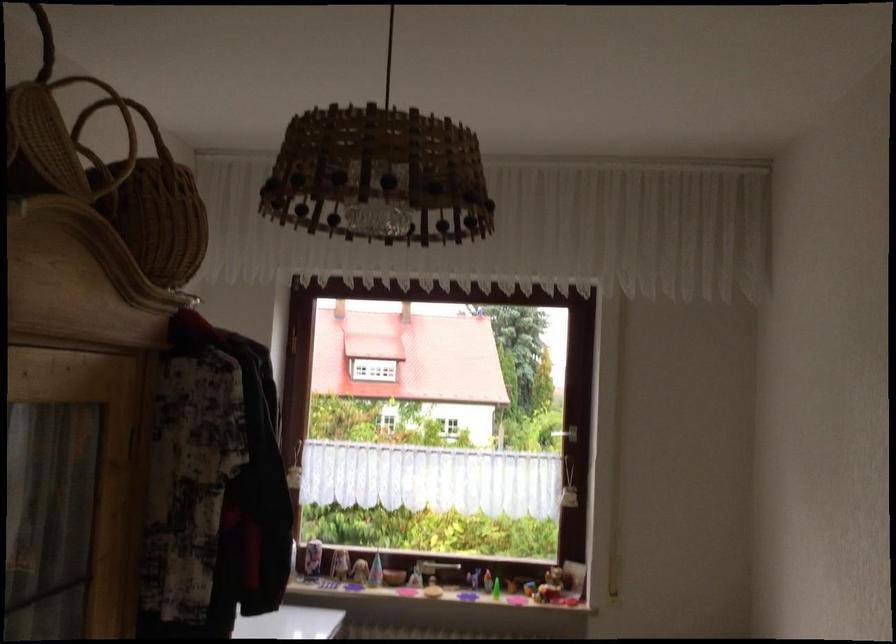
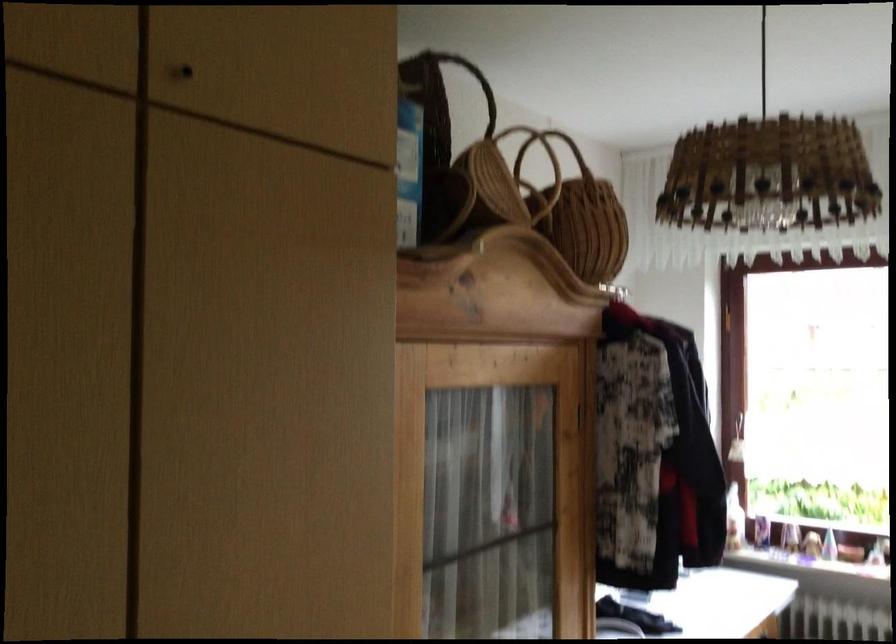
Where in the second image is the point corresponding to pixel 89 146 from the first image?

(533, 169)